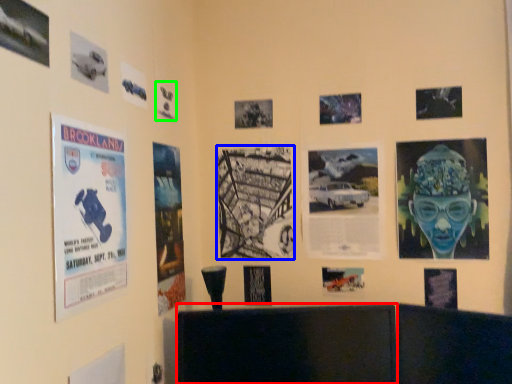
Question: Estimate the real-world distances between objects in this image. Which object is closer to furniture (highlighted by a red box), poster (highlighted by a blue box) or poster (highlighted by a green box)?

Choices:
 (A) poster
 (B) poster

Answer: (A)